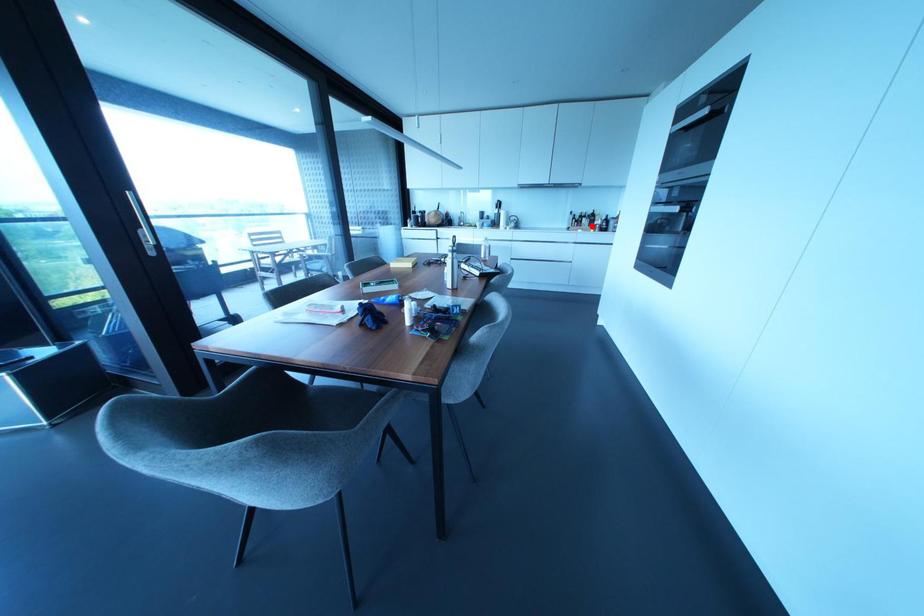
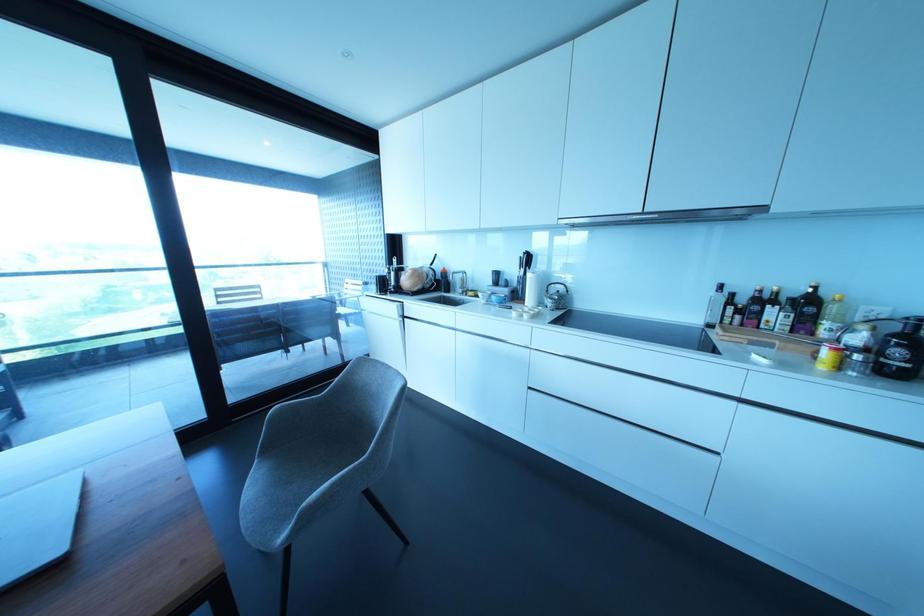
Question: I am providing you with two images of the same scene from different viewpoints. In image1, a red point is highlighted. Considering the same 3D point in image2, which of the following is correct?

Choices:
 (A) It is closer
 (B) It is farther

Answer: (B)